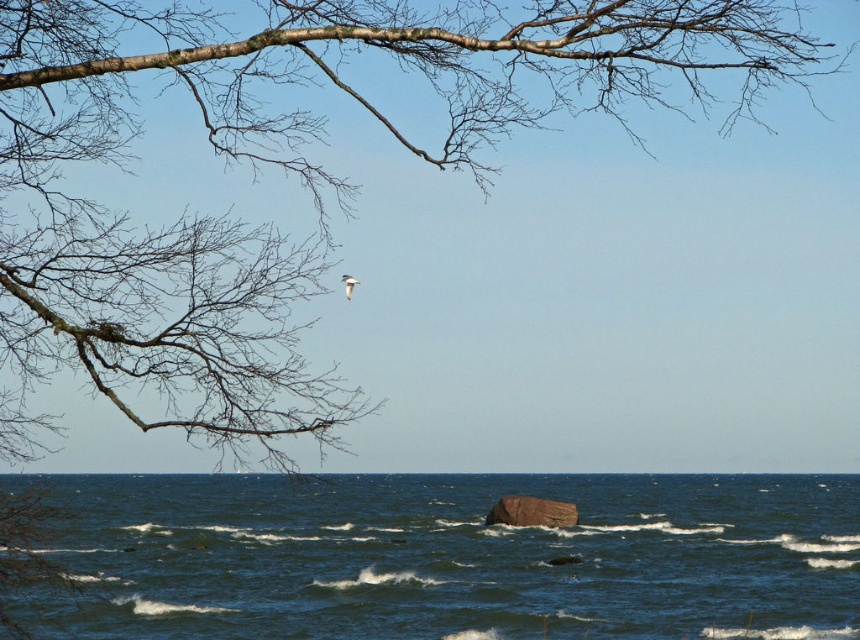
You are standing at the edge of the water and want to cross to the other side. The dark blue water at center and brown rough rock at center are in your path. Which one should you avoid stepping on to cross safely?

You should avoid stepping on the brown rough rock at center because it is narrower than the dark blue water at center, making it less stable for crossing.